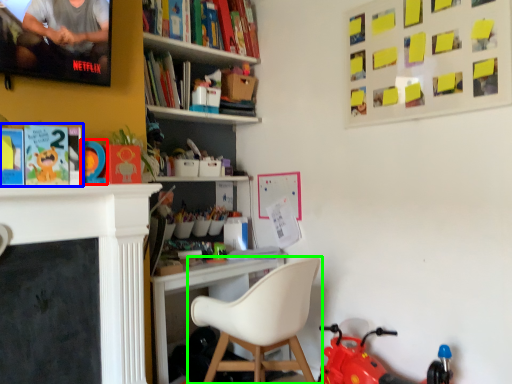
Question: Which object is the closest to the toy (highlighted by a red box)? Choose among these: book (highlighted by a blue box) or chair (highlighted by a green box).

Choices:
 (A) book
 (B) chair

Answer: (A)